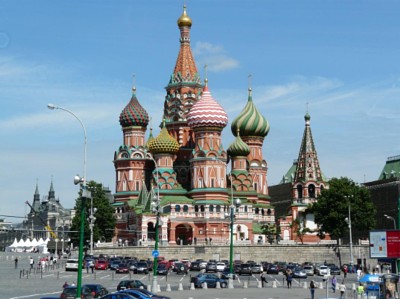
This screenshot has height=299, width=400. Find the location of `rod`. rod is located at coordinates (128, 91), (196, 64), (242, 85), (299, 120), (181, 5).